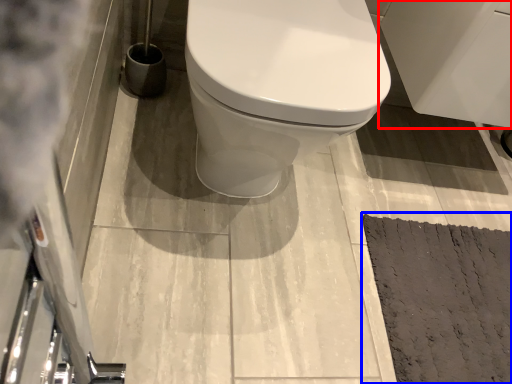
Question: Which of the following is the farthest to the observer, porcelain (highlighted by a red box) or doormat (highlighted by a blue box)?

Choices:
 (A) porcelain
 (B) doormat

Answer: (B)